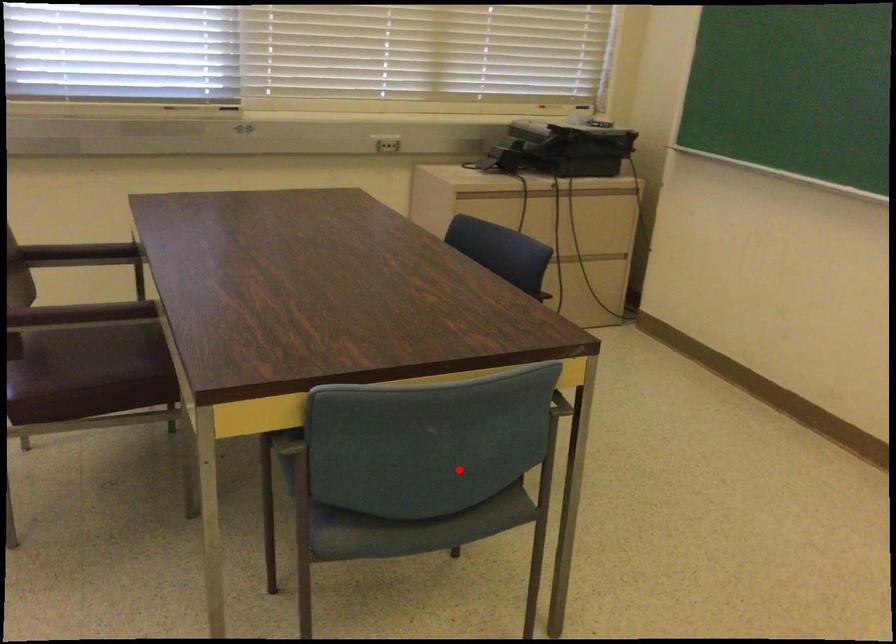
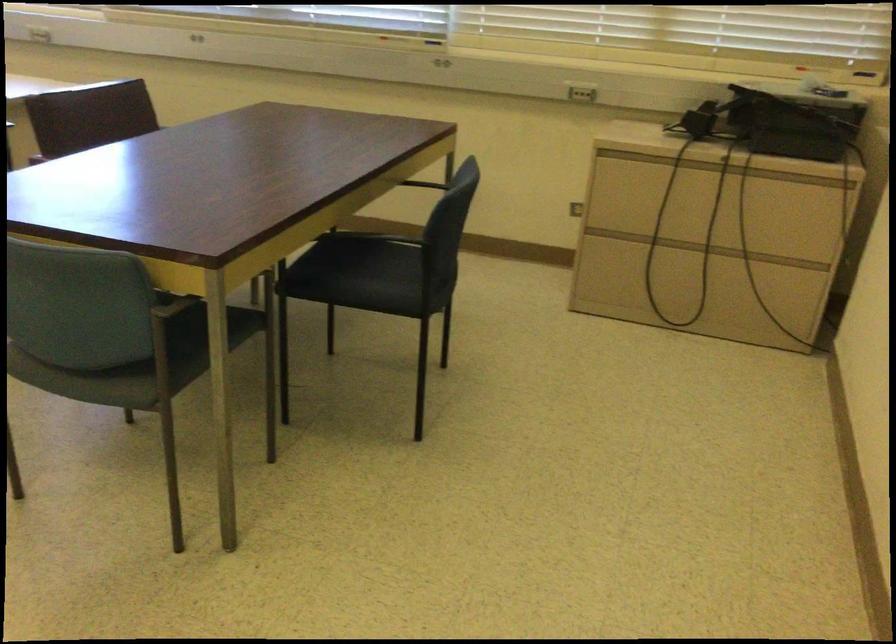
Question: I am providing you with two images of the same scene from different viewpoints. Given a red point in image1, look at the same physical point in image2. Is it:

Choices:
 (A) Closer to the viewpoint
 (B) Farther from the viewpoint

Answer: (B)